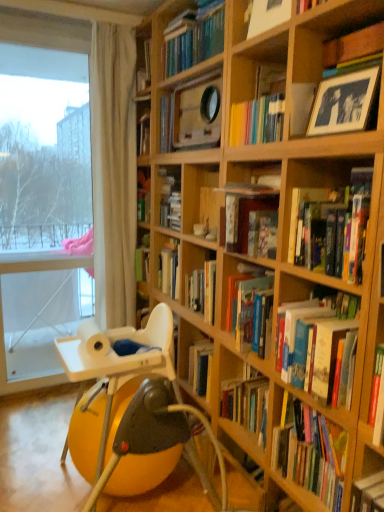
Question: In terms of width, does white plastic chair at lower left look wider or thinner when compared to blue-toned matte photo frame at upper right?

Choices:
 (A) wide
 (B) thin

Answer: (A)

Question: From the image's perspective, is white plastic chair at lower left located above or below blue-toned matte photo frame at upper right?

Choices:
 (A) below
 (B) above

Answer: (A)

Question: Based on their relative distances, which object is farther from the blue-toned matte photo frame at upper right?

Choices:
 (A) hardcover book at upper center, which is the 6th book from bottom to top
 (B) hardcover book at center, acting as the 4th book starting from the top
 (C) transparent glass window at left
 (D) hardcover books at center, arranged as the 1th book when ordered from the bottom
 (E) hardcover book at center, which ranks as the second book in bottom-to-top order

Answer: (C)

Question: Which object is positioned farthest from the wooden frame at upper center, marked as the 5th book in a bottom-to-top arrangement?

Choices:
 (A) blue-toned matte photo frame at upper right
 (B) transparent glass window at left
 (C) white plastic chair at lower left
 (D) hardcover book at center, the third book positioned from the bottom
 (E) white sheer curtain at left

Answer: (B)